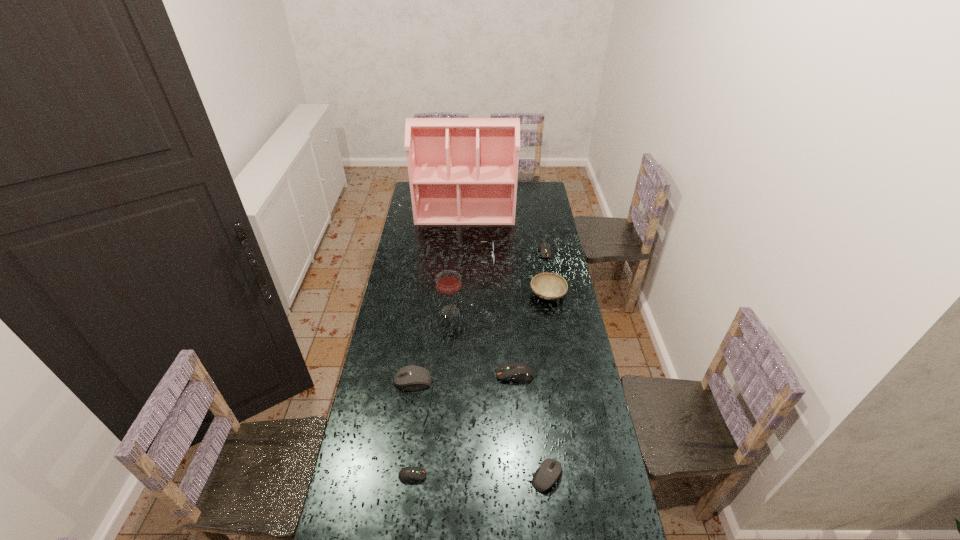
I want to click on the farthest dark computer equipment, so click(x=545, y=251).

The width and height of the screenshot is (960, 540). I want to click on the rightmost dark computer equipment, so click(x=545, y=251).

Find the location of `the right black computer equipment`. the right black computer equipment is located at coordinates 550,470.

Image resolution: width=960 pixels, height=540 pixels. Identify the location of the smaller black computer equipment. (550, 470).

Find the location of `the shortest object`. the shortest object is located at coordinates (408, 474).

At what (x,y) coordinates should I click in order to perform the action: click on the leftmost dark computer equipment. Please return your answer as a coordinate pair (x, y). Image resolution: width=960 pixels, height=540 pixels. Looking at the image, I should click on (408, 474).

The width and height of the screenshot is (960, 540). In order to click on vacant space located on the front-facing side of the farthest object in this screenshot , I will do `click(464, 238)`.

The image size is (960, 540). In order to click on vacant space positioned 0.190m on the back of the second tallest object in this screenshot , I will do `click(453, 276)`.

Identify the location of free space located on the front of the bowl. Image resolution: width=960 pixels, height=540 pixels. (559, 359).

Locate an element on the screen. blank space located on the lenses of the spectacles is located at coordinates (543, 258).